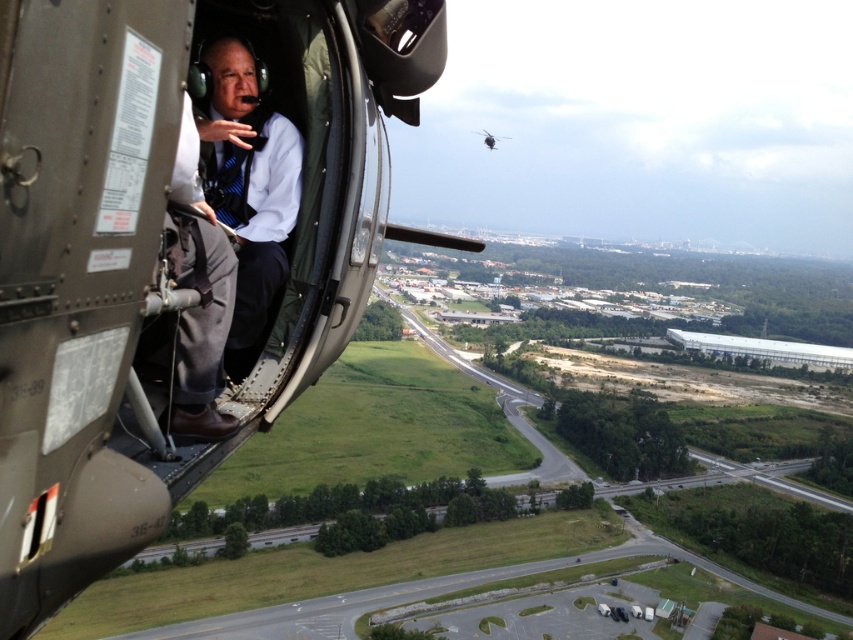
Question: Which of the following is the farthest from the observer?

Choices:
 (A) metallic gray helicopter at left
 (B) metallic silver helicopter at upper center
 (C) matte black shirt at center

Answer: (B)

Question: From the image, what is the correct spatial relationship of matte black shirt at center in relation to metallic silver helicopter at upper center?

Choices:
 (A) left
 (B) right

Answer: (A)

Question: Among these objects, which one is nearest to the camera?

Choices:
 (A) metallic gray helicopter at left
 (B) metallic silver helicopter at upper center
 (C) matte black shirt at center

Answer: (A)

Question: Is metallic gray helicopter at left to the left of metallic silver helicopter at upper center from the viewer's perspective?

Choices:
 (A) no
 (B) yes

Answer: (B)

Question: Which point is closer to the camera?

Choices:
 (A) (492, 140)
 (B) (257, 141)
 (C) (79, 401)

Answer: (C)

Question: Can you confirm if matte black shirt at center is bigger than metallic silver helicopter at upper center?

Choices:
 (A) no
 (B) yes

Answer: (A)